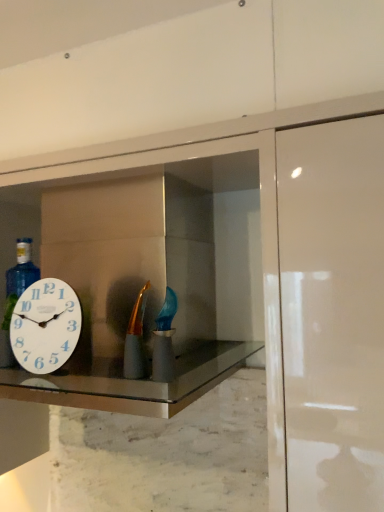
Question: From a real-world perspective, is white glossy clock at left on marble at center?

Choices:
 (A) no
 (B) yes

Answer: (B)

Question: Is the position of white glossy clock at left less distant than that of marble at center?

Choices:
 (A) no
 (B) yes

Answer: (A)

Question: From the image's perspective, would you say white glossy clock at left is positioned over marble at center?

Choices:
 (A) no
 (B) yes

Answer: (B)

Question: Does white glossy clock at left have a smaller size compared to marble at center?

Choices:
 (A) yes
 (B) no

Answer: (A)

Question: Does white glossy clock at left appear on the left side of marble at center?

Choices:
 (A) yes
 (B) no

Answer: (A)

Question: Does white glossy clock at left have a greater height compared to marble at center?

Choices:
 (A) no
 (B) yes

Answer: (B)

Question: Is white glossy medicine cabinet at center positioned beyond the bounds of white glossy clock at left?

Choices:
 (A) no
 (B) yes

Answer: (B)

Question: Can you confirm if white glossy medicine cabinet at center is shorter than white glossy clock at left?

Choices:
 (A) no
 (B) yes

Answer: (A)

Question: From the image's perspective, is white glossy medicine cabinet at center on white glossy clock at left?

Choices:
 (A) no
 (B) yes

Answer: (A)

Question: From a real-world perspective, is white glossy medicine cabinet at center on top of white glossy clock at left?

Choices:
 (A) yes
 (B) no

Answer: (B)

Question: Is white glossy medicine cabinet at center oriented towards white glossy clock at left?

Choices:
 (A) yes
 (B) no

Answer: (A)

Question: Is white glossy clock at left at the back of white glossy medicine cabinet at center?

Choices:
 (A) no
 (B) yes

Answer: (B)

Question: Can you confirm if matte gold bottle at center is positioned to the left of white glossy medicine cabinet at center?

Choices:
 (A) no
 (B) yes

Answer: (A)